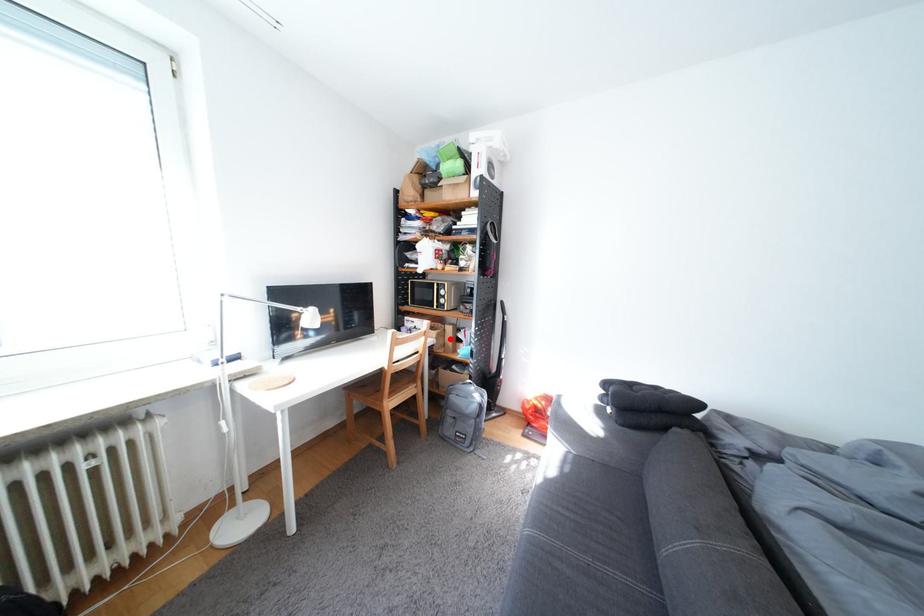
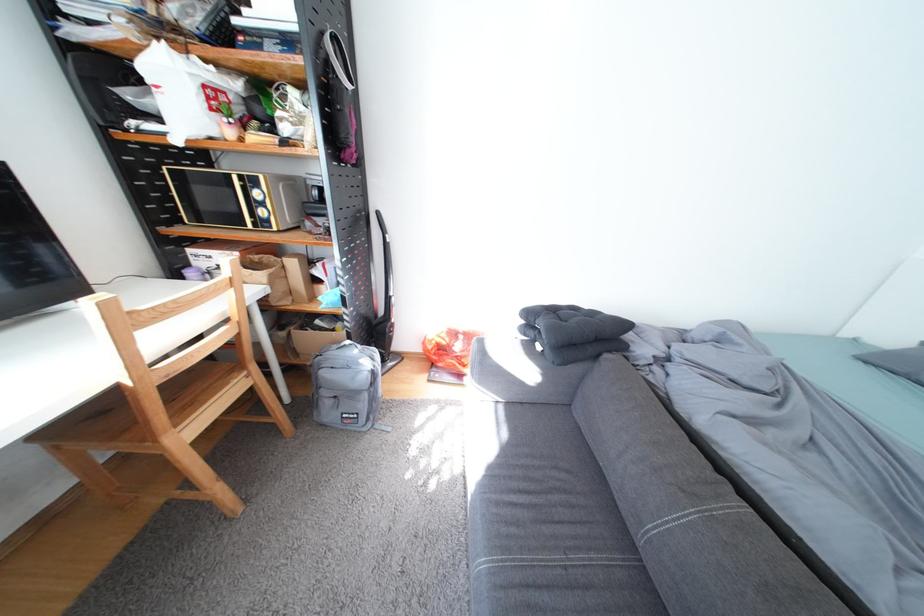
Question: A red point is marked in image1. In image2, is the corresponding 3D point closer to the camera or farther? Reply with the corresponding letter.

Choices:
 (A) The corresponding 3D point is closer.
 (B) The corresponding 3D point is farther.

Answer: (A)